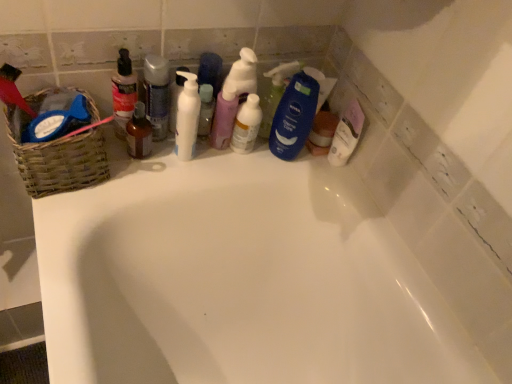
Where is `free space in front of translucent plastic spray bottle at center, the first cleaning product in the left-to-right sequence`? free space in front of translucent plastic spray bottle at center, the first cleaning product in the left-to-right sequence is located at coordinates (133, 180).